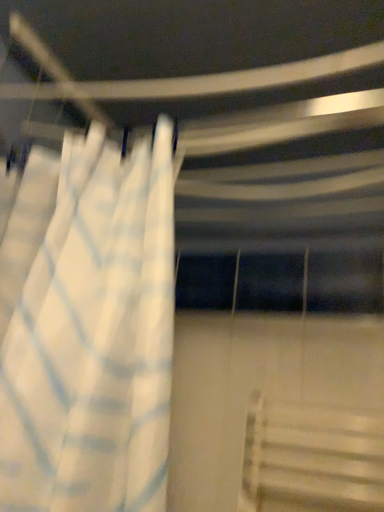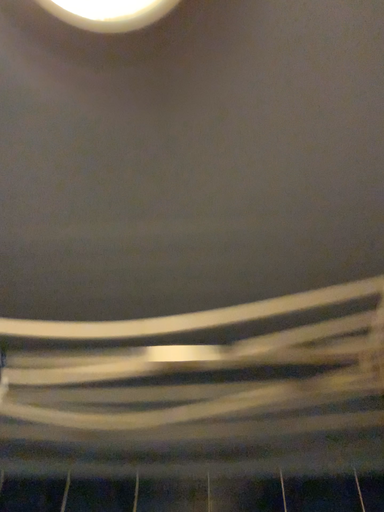
Question: How did the camera likely rotate when shooting the video?

Choices:
 (A) rotated upward
 (B) rotated downward

Answer: (A)